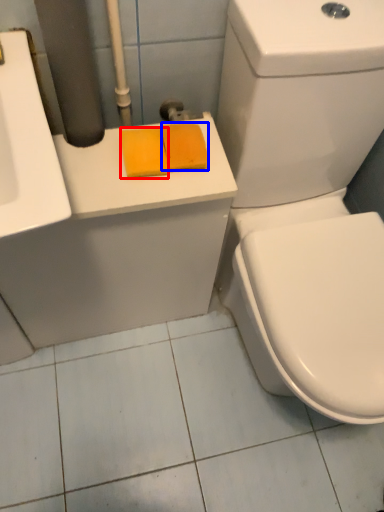
Question: Which object appears farthest to the camera in this image, soap (highlighted by a red box) or soap (highlighted by a blue box)?

Choices:
 (A) soap
 (B) soap

Answer: (B)